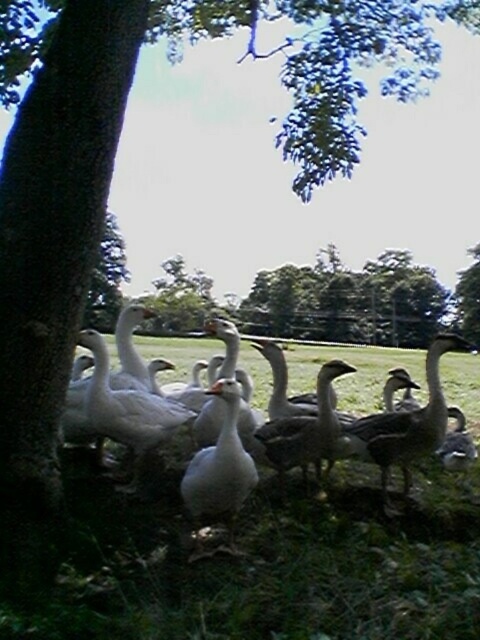
Does white matte duck at left lie in front of white feathered goose at left?

No, it is not.

Can you confirm if white matte duck at left is bigger than white feathered goose at left?

Correct, white matte duck at left is larger in size than white feathered goose at left.

Image resolution: width=480 pixels, height=640 pixels. What do you see at coordinates (128, 390) in the screenshot?
I see `white matte duck at left` at bounding box center [128, 390].

In order to click on white matte duck at left in this screenshot , I will do `click(128, 390)`.

Does green leafy tree at upper center appear over dark gray duck at center?

Yes.

Does green leafy tree at upper center appear on the left side of dark gray duck at center?

Incorrect, green leafy tree at upper center is not on the left side of dark gray duck at center.

What do you see at coordinates (468, 298) in the screenshot? The height and width of the screenshot is (640, 480). I see `green leafy tree at upper center` at bounding box center [468, 298].

Where is `green leafy tree at upper center`? The image size is (480, 640). green leafy tree at upper center is located at coordinates (468, 298).

Is white matte duck at left closer to camera compared to green leafy tree at upper center?

Yes, white matte duck at left is in front of green leafy tree at upper center.

Where is `white matte duck at left`? white matte duck at left is located at coordinates (128, 390).